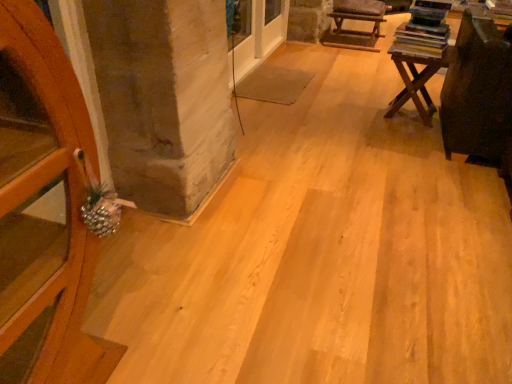
At what (x,y) coordinates should I click in order to perform the action: click on free point in front of wooden table at right. Please return your answer as a coordinate pair (x, y). The width and height of the screenshot is (512, 384). Looking at the image, I should click on (406, 137).